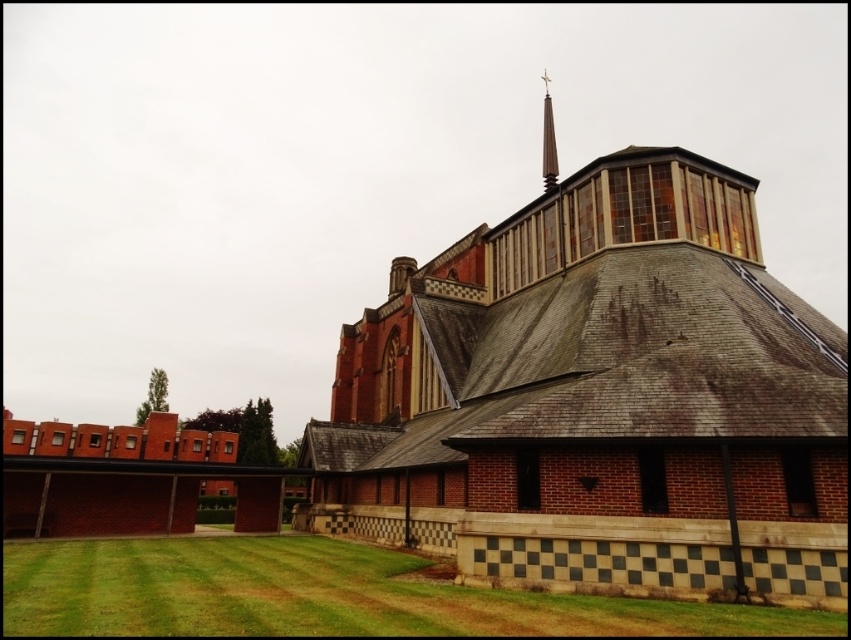
Question: Does brick church at center have a greater width compared to smooth gray spire at upper center?

Choices:
 (A) yes
 (B) no

Answer: (B)

Question: Can you confirm if brick church at center is positioned below smooth gray spire at upper center?

Choices:
 (A) yes
 (B) no

Answer: (A)

Question: Based on their relative distances, which object is farther from the brick church at center?

Choices:
 (A) smooth gray spire at upper center
 (B) green grass at lower left

Answer: (A)

Question: Which object appears farthest from the camera in this image?

Choices:
 (A) green grass at lower left
 (B) brick church at center
 (C) smooth gray spire at upper center

Answer: (C)

Question: Among these points, which one is nearest to the camera?

Choices:
 (A) (549, 108)
 (B) (49, 550)

Answer: (B)

Question: Observing the image, what is the correct spatial positioning of brick church at center in reference to smooth gray spire at upper center?

Choices:
 (A) right
 (B) left

Answer: (B)